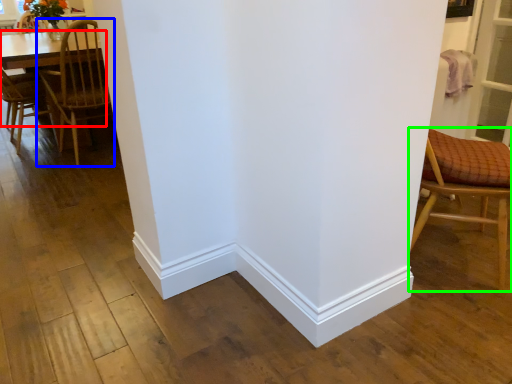
Question: Considering the real-world distances, which object is farthest from table (highlighted by a red box)? chair (highlighted by a blue box) or chair (highlighted by a green box)?

Choices:
 (A) chair
 (B) chair

Answer: (B)